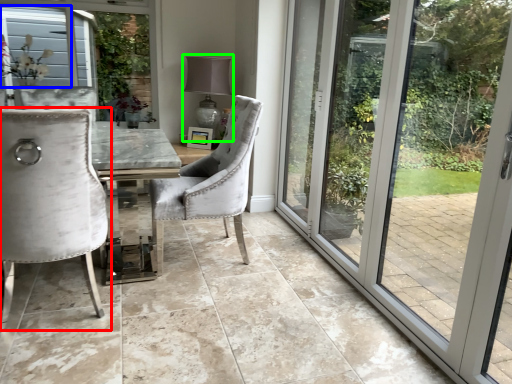
Question: Based on their relative distances, which object is nearer to chair (highlighted by a red box)? Choose from window screen (highlighted by a blue box) and lamp (highlighted by a green box).

Choices:
 (A) window screen
 (B) lamp

Answer: (B)